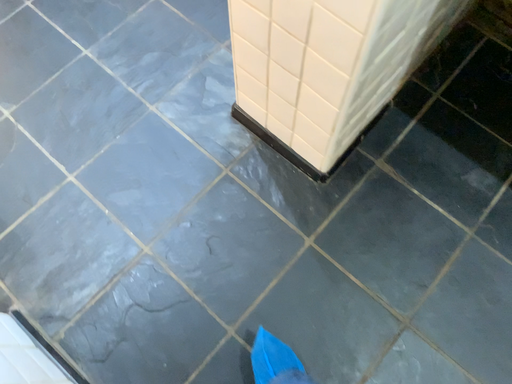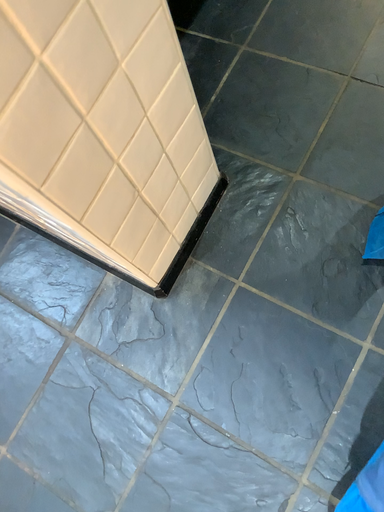
Question: How did the camera likely rotate when shooting the video?

Choices:
 (A) rotated upward
 (B) rotated downward

Answer: (A)